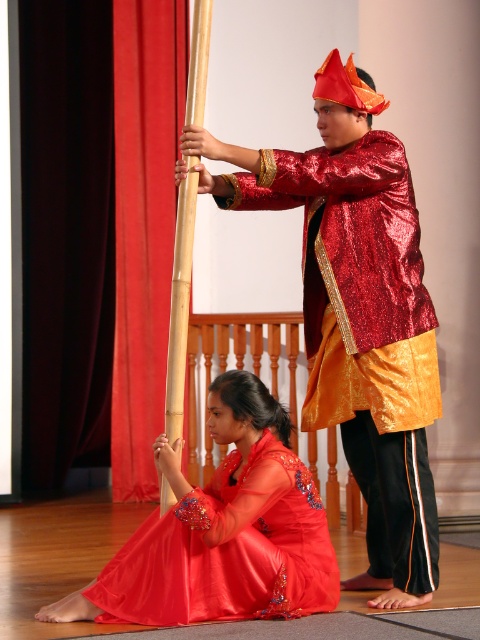
Question: Which point is farther from the camera taking this photo?

Choices:
 (A) (250, 488)
 (B) (414, 228)

Answer: (B)

Question: Can you confirm if shiny red robe at center is positioned to the right of satin red dress at lower center?

Choices:
 (A) yes
 (B) no

Answer: (A)

Question: Is shiny red robe at center to the right of satin red dress at lower center from the viewer's perspective?

Choices:
 (A) no
 (B) yes

Answer: (B)

Question: Which point appears closest to the camera in this image?

Choices:
 (A) (337, 304)
 (B) (228, 403)

Answer: (B)

Question: Is shiny red robe at center below satin red dress at lower center?

Choices:
 (A) yes
 (B) no

Answer: (B)